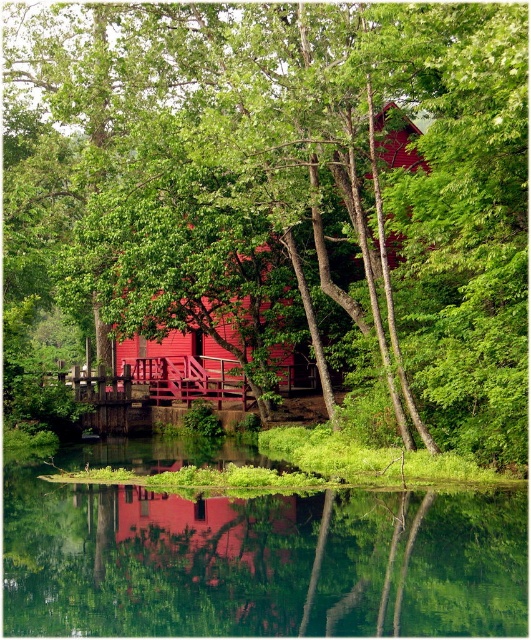
Question: Based on their relative distances, which object is farther from the green leafy tree at center?

Choices:
 (A) clear glass water at center
 (B) matte red cabin at center

Answer: (A)

Question: Is clear glass water at center positioned before matte red cabin at center?

Choices:
 (A) no
 (B) yes

Answer: (B)

Question: Which point is farther from the camera taking this photo?

Choices:
 (A) (309, 132)
 (B) (407, 156)
 (C) (41, 544)

Answer: (B)

Question: Is clear glass water at center positioned behind matte red cabin at center?

Choices:
 (A) no
 (B) yes

Answer: (A)

Question: Does green leafy tree at center have a larger size compared to clear glass water at center?

Choices:
 (A) no
 (B) yes

Answer: (B)

Question: Which point appears closest to the camera in this image?

Choices:
 (A) (149, 616)
 (B) (397, 120)
 (C) (371, 180)

Answer: (A)